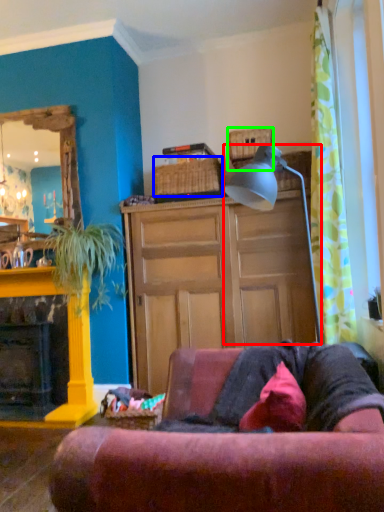
Question: Which object is positioned farthest from lamp (highlighted by a red box)? Select from picnic basket (highlighted by a blue box) and picnic basket (highlighted by a green box).

Choices:
 (A) picnic basket
 (B) picnic basket

Answer: (A)